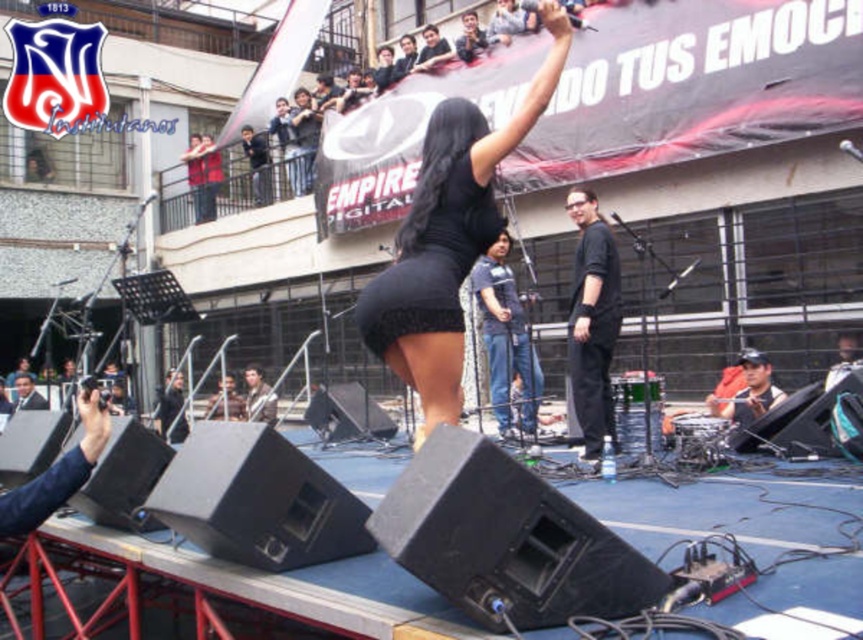
You are a photographer taking a picture of the black matte skirt at center and the dark blue baseball cap at lower right. Which object should you adjust your camera to focus on first if you want to capture both in the same frame?

The black matte skirt at center is positioned on the left side of dark blue baseball cap at lower right, so you should focus on the dark blue baseball cap at lower right first to ensure both are in the frame.

From the picture: You are standing at the center of the stage where the black matte pants at center are located. You want to throw a small object to the dark blue baseball cap at lower right. What is the approximate distance you need to throw it?

The black matte pants at center is 5.49 feet away from the dark blue baseball cap at lower right, so you need to throw the object approximately 5.49 feet to reach it.

You are standing at the point with coordinates point (433, 269) and want to move towards the point with coordinates point (446, 308). Is the point you want to move to behind you or in front of you?

The point (446, 308) is behind point (433, 269), so the point you want to move to is behind you.